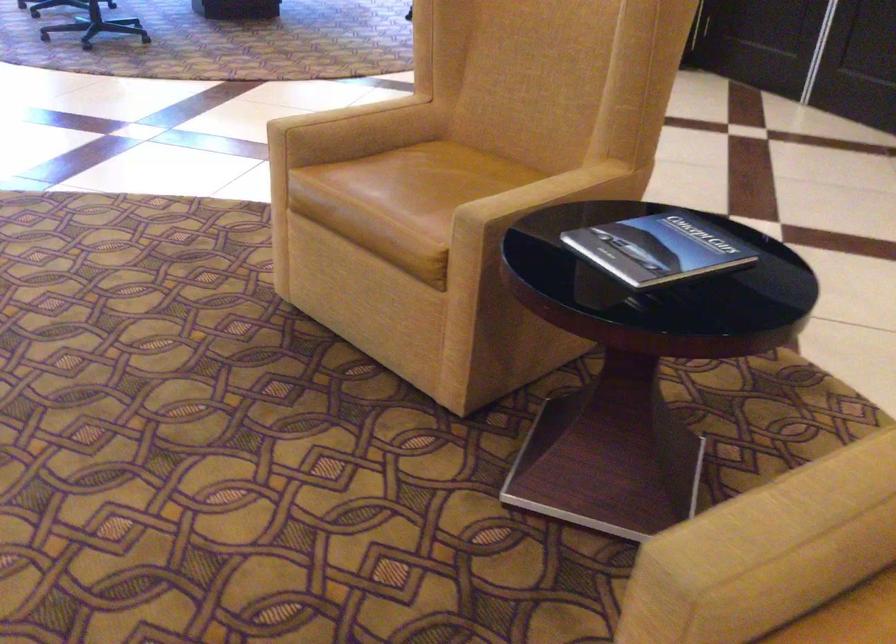
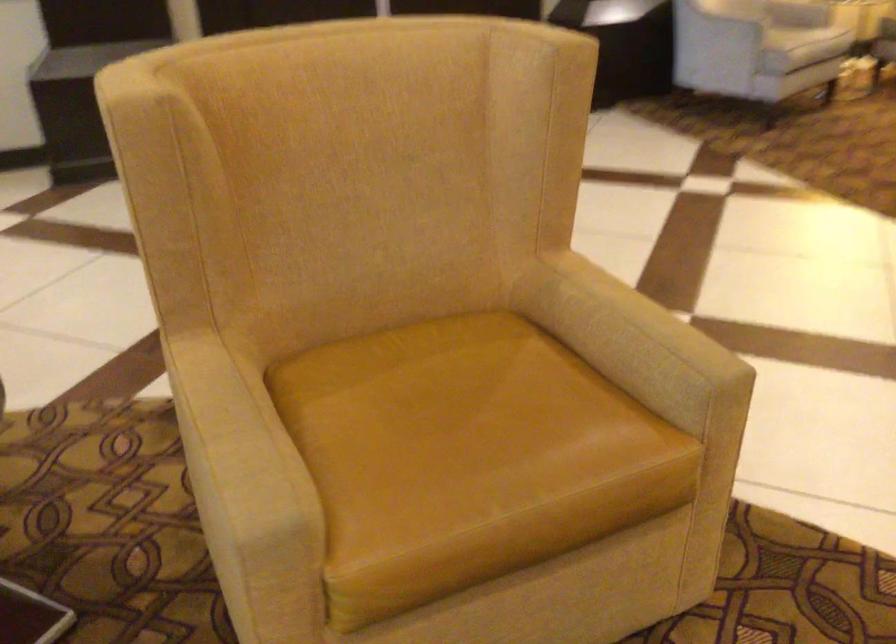
Locate, in the second image, the point that corresponds to (x=791, y=496) in the first image.

(235, 435)